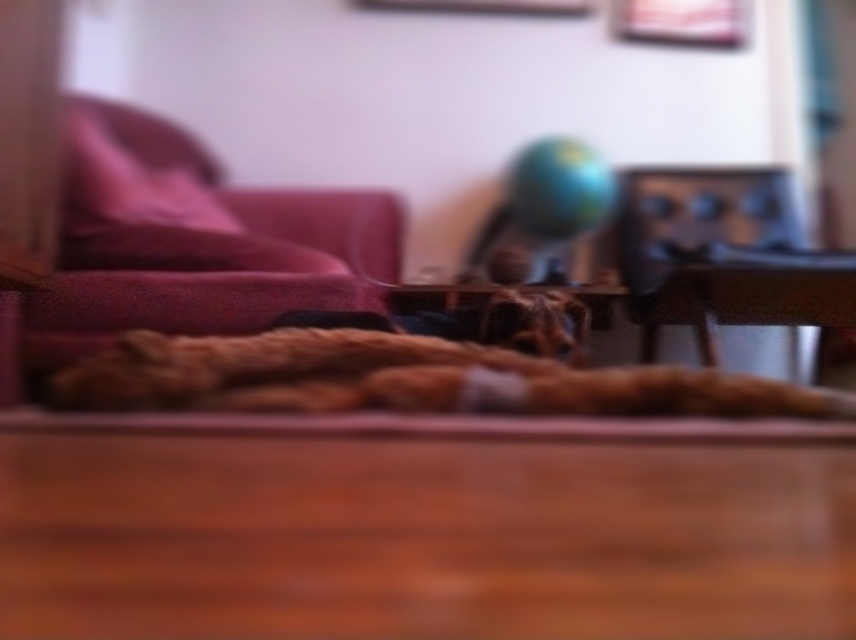
You are arranging items on a wooden table. You have a shiny metallic globe at center and a wooden picture frame at upper center. According to the scene, which item is positioned to the left of the other?

The shiny metallic globe at center is to the left of the wooden picture frame at upper center.

You are organizing a space and need to place a small plant between the fluffy brown dog at center and the wooden picture frame at upper center. Based on their positions, where should you place the plant?

The fluffy brown dog at center is below the wooden picture frame at upper center, so you should place the plant between them vertically, positioning it above the dog and below the frame to maintain alignment.

You are organizing a space for a new pet and need to ensure there is enough room between the fluffy brown dog at center and the wooden picture frame at upper center. According to the image, which object is located to the left of the other?

The fluffy brown dog at center is positioned on the left side of wooden picture frame at upper center.